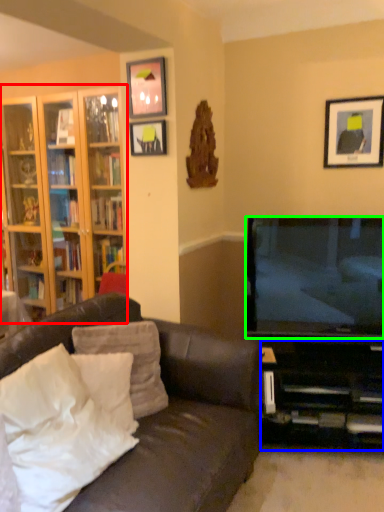
Question: Considering the real-world distances, which object is farthest from cabinetry (highlighted by a red box)? entertainment center (highlighted by a blue box) or television (highlighted by a green box)?

Choices:
 (A) entertainment center
 (B) television

Answer: (A)